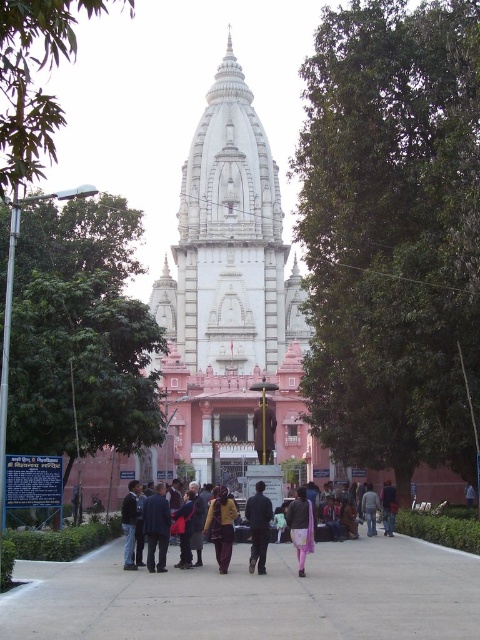
Question: Can you confirm if gray concrete pavement at center is thinner than dark blue jacket at center?

Choices:
 (A) no
 (B) yes

Answer: (A)

Question: Which of the following is the farthest from the observer?

Choices:
 (A) pink fabric pants at center
 (B) dark blue jeans at lower center

Answer: (B)

Question: Is white marble hindu temple at center bigger than dark blue jeans at lower center?

Choices:
 (A) no
 (B) yes

Answer: (B)

Question: Can you confirm if matte yellow dress at center is smaller than pink fabric pants at center?

Choices:
 (A) no
 (B) yes

Answer: (A)

Question: Which is farther from the yellow fabric dress at center?

Choices:
 (A) gray concrete pavement at center
 (B) dark blue jeans at lower center
 (C) pink fabric pants at center

Answer: (B)

Question: Which object is the closest to the pink fabric pants at center?

Choices:
 (A) matte yellow dress at center
 (B) yellow fabric dress at center

Answer: (A)